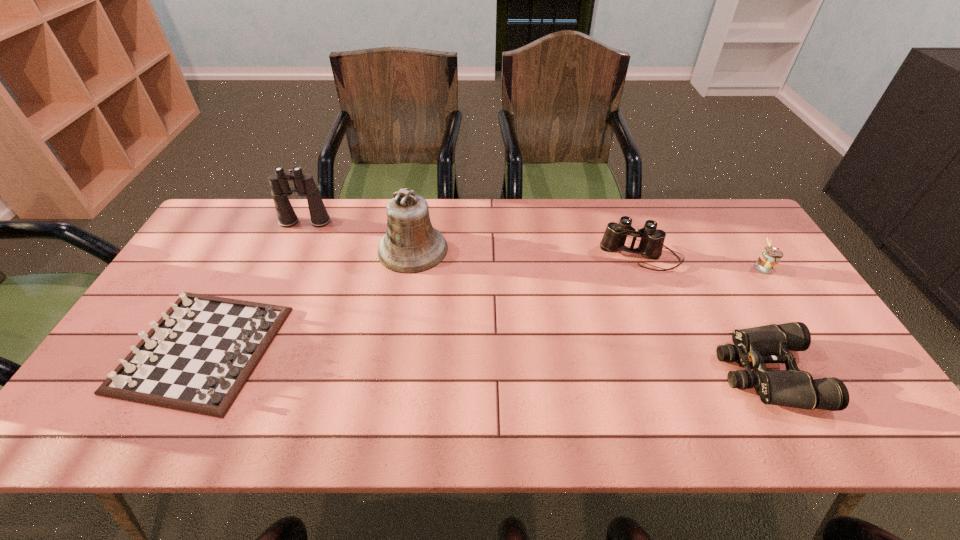
Identify the location of vacant space at the far right corner of the desktop. (699, 213).

At what (x,y) coordinates should I click in order to perform the action: click on empty location between the third object from left to right and the tallest binoculars. Please return your answer as a coordinate pair (x, y). Looking at the image, I should click on (359, 235).

The image size is (960, 540). In order to click on free space between the bell and the chessboard in this screenshot , I will do `click(307, 299)`.

You are a GUI agent. You are given a task and a screenshot of the screen. Output one action in this format:
    pyautogui.click(x=<x>, y=<y>)
    Task: Click on the vacant point located between the leftmost binoculars and the third object from left to right
    Image resolution: width=960 pixels, height=540 pixels.
    Given the screenshot: What is the action you would take?
    pyautogui.click(x=359, y=235)

The image size is (960, 540). Find the location of `vacant point located between the chessboard and the nearest binoculars`. vacant point located between the chessboard and the nearest binoculars is located at coordinates (485, 361).

Where is `free space between the nearest binoculars and the leftmost binoculars`? This screenshot has height=540, width=960. free space between the nearest binoculars and the leftmost binoculars is located at coordinates (536, 298).

Locate an element on the screen. free space between the nearest binoculars and the second farthest binoculars is located at coordinates (705, 315).

Where is `empty location between the chessboard and the second nearest binoculars`? The width and height of the screenshot is (960, 540). empty location between the chessboard and the second nearest binoculars is located at coordinates (422, 303).

Locate an element on the screen. Image resolution: width=960 pixels, height=540 pixels. vacant space that's between the leftmost binoculars and the fourth tallest object is located at coordinates (534, 245).

Where is `vacant region between the nearest binoculars and the fourth object from right to left`? Image resolution: width=960 pixels, height=540 pixels. vacant region between the nearest binoculars and the fourth object from right to left is located at coordinates pos(589,311).